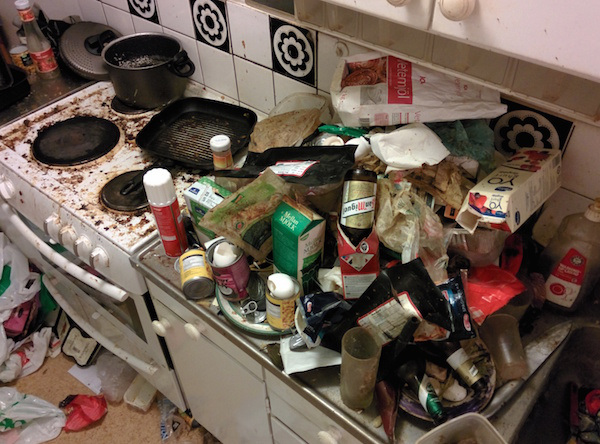
This screenshot has width=600, height=444. Find the location of `skillet`. skillet is located at coordinates (193, 142).